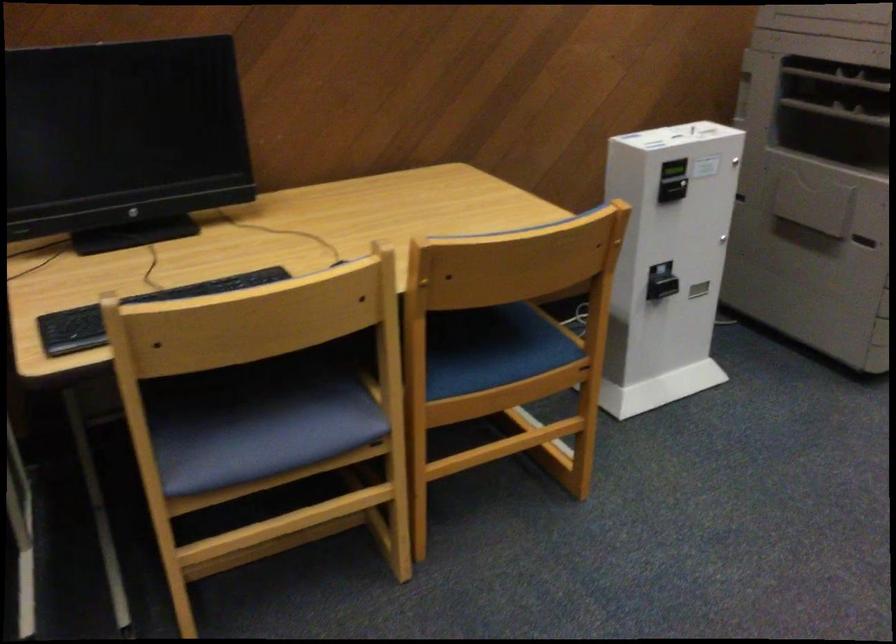
The location [134,310] corresponds to which object?

It corresponds to the black keyboard in the image.